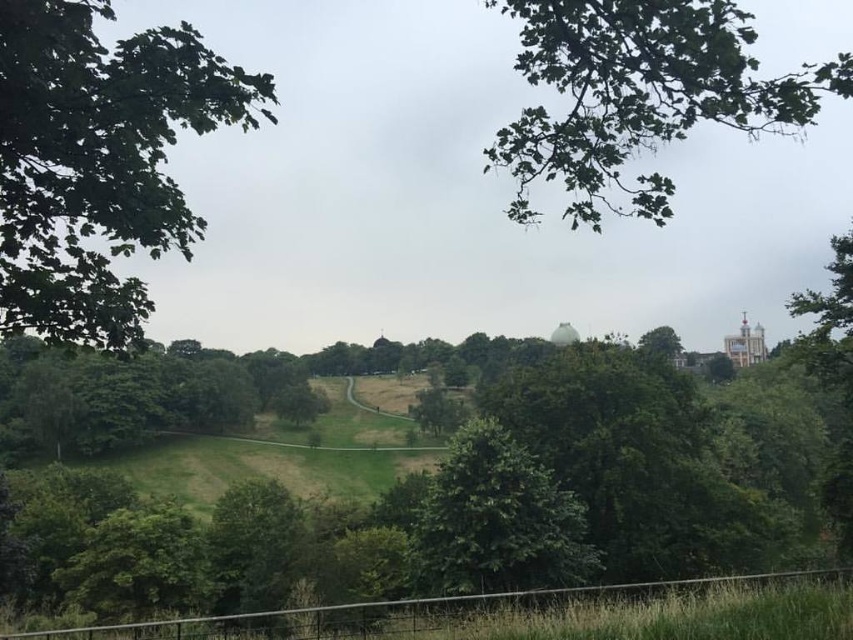
You are standing at the viewpoint overlooking the park and see the green leafy tree at upper right and the green leafy tree at center. Which tree is closer to you?

The green leafy tree at upper right is closer to you because it is positioned in front of the green leafy tree at center.

You are standing at the center of the park and want to take a photo that includes the green leafy tree at left. Based on its position, in which direction should you point your camera to capture it?

The green leafy tree at left is positioned at point 0.253 on the x axis and 0.116 on the y axis. Since the coordinates are lower than the center point, you should point your camera to the left and slightly downward to capture the green leafy tree at left.